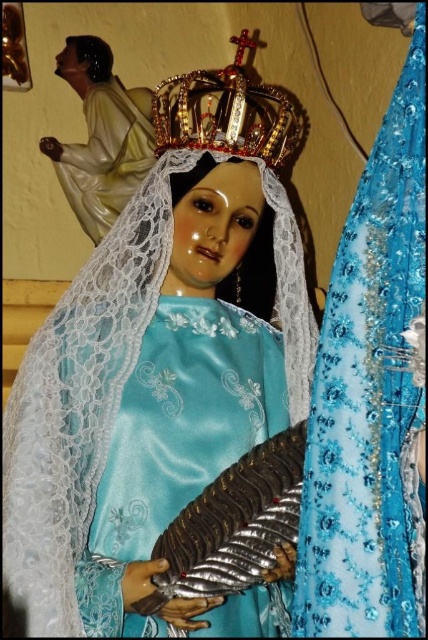
Can you confirm if matte white statue at upper left is taller than gold jeweled crown at upper center?

Yes, matte white statue at upper left is taller than gold jeweled crown at upper center.

Does point (109, 193) come closer to viewer compared to point (231, 80)?

That is False.

The height and width of the screenshot is (640, 428). Find the location of `matte white statue at upper left`. matte white statue at upper left is located at coordinates (101, 136).

Is satin blue dress at center to the left of matte white statue at upper left from the viewer's perspective?

In fact, satin blue dress at center is to the right of matte white statue at upper left.

Does point (86, 568) lie in front of point (148, 152)?

Yes, point (86, 568) is in front of point (148, 152).

You are a GUI agent. You are given a task and a screenshot of the screen. Output one action in this format:
    pyautogui.click(x=<x>, y=<y>)
    Task: Click on the satin blue dress at center
    
    Given the screenshot: What is the action you would take?
    pyautogui.click(x=163, y=376)

Which of these two, satin blue dress at center or gold jeweled crown at upper center, stands taller?

satin blue dress at center

Can you confirm if satin blue dress at center is positioned to the left of gold jeweled crown at upper center?

Correct, you'll find satin blue dress at center to the left of gold jeweled crown at upper center.

Between point (137, 513) and point (208, 115), which one is positioned behind?

Positioned behind is point (208, 115).

What are the coordinates of `satin blue dress at center` in the screenshot? It's located at (163, 376).